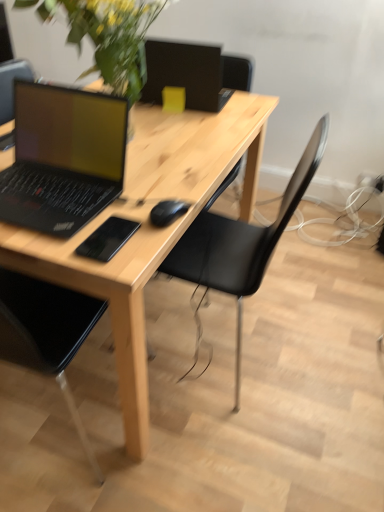
Where is `free area in between black matte mousepad at center and matte black laptop at left`? The height and width of the screenshot is (512, 384). free area in between black matte mousepad at center and matte black laptop at left is located at coordinates (104, 213).